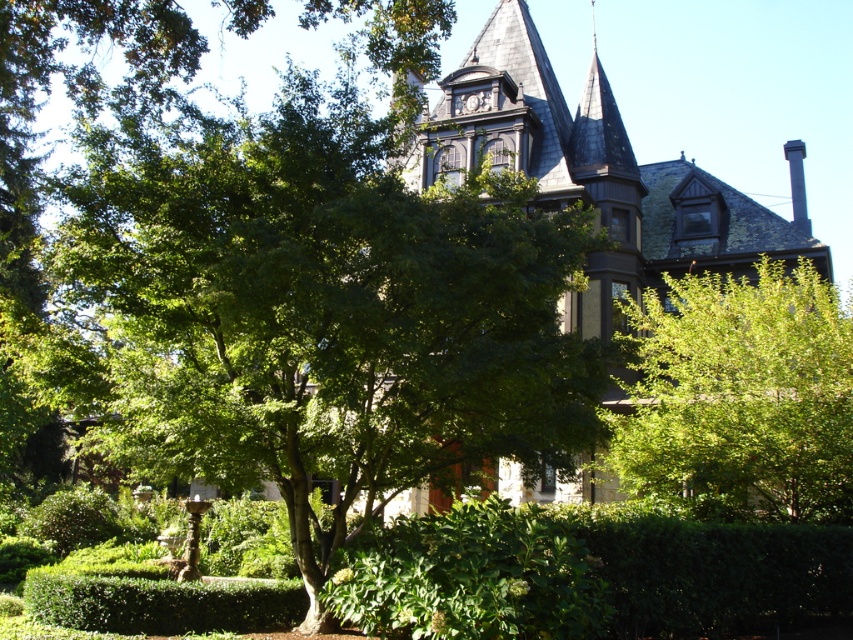
Does green leafy tree at center appear under green leafy bush at right?

No.

Between point (231, 328) and point (733, 410), which one is positioned in front?

Point (231, 328) is more forward.

This screenshot has height=640, width=853. In order to click on green leafy tree at center in this screenshot , I will do `click(323, 310)`.